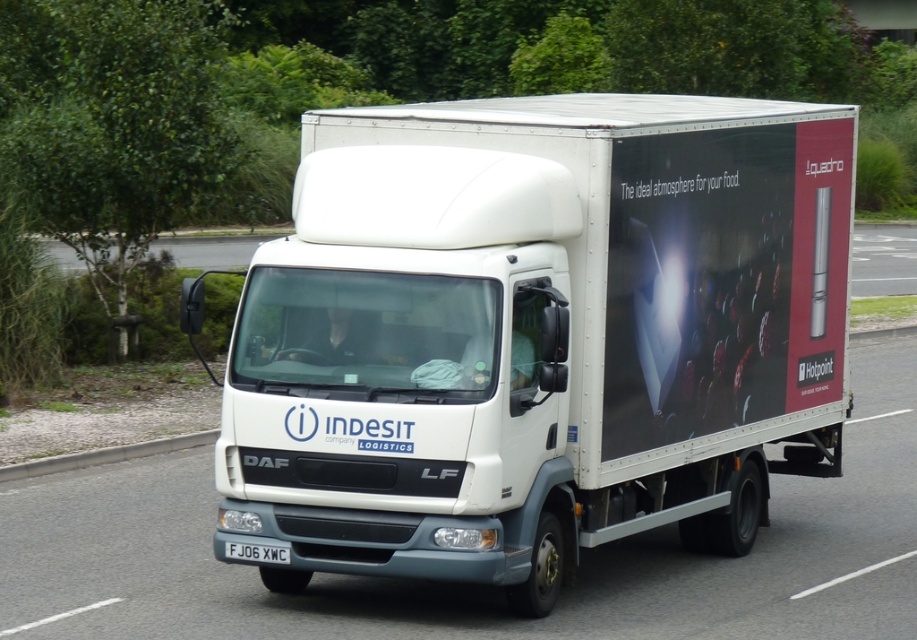
Who is positioned more to the right, white matte trailer truck at center or white plastic license plate at center?

white matte trailer truck at center is more to the right.

Between point (801, 321) and point (236, 548), which one is positioned behind?

The point (801, 321) is more distant.

Identify the location of white matte trailer truck at center. Image resolution: width=917 pixels, height=640 pixels. (537, 333).